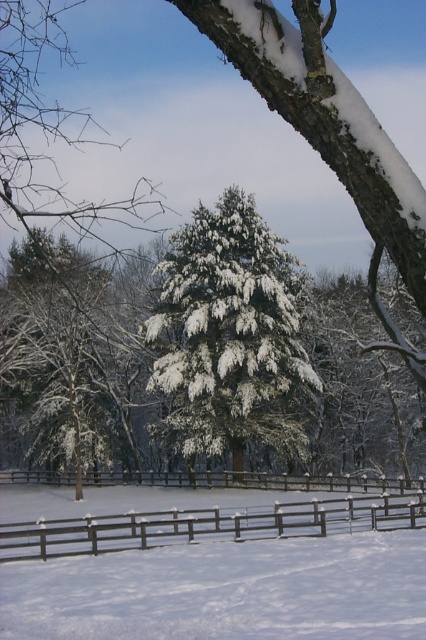
Looking at this image, you are an observer standing in front of the snow scene. You notice the brown wooden fence at lower center and the white fluffy tree at center. Which object is closer to you?

The white fluffy tree at center is closer to you because the brown wooden fence at lower center is behind it.

You are a photographer trying to capture the entire white fluffy tree at center and brown wooden fence at center in one frame. Given that your camera can only focus on objects up to 10 meters tall, will both objects fit within the camera focus range?

The white fluffy tree at center has a greater height compared to brown wooden fence at center. Since the camera can focus on objects up to 10 meters tall, both objects will fit within the focus range as long as their heights are under 10 meters. However, the exact heights are not provided, so we cannot confirm definitively.